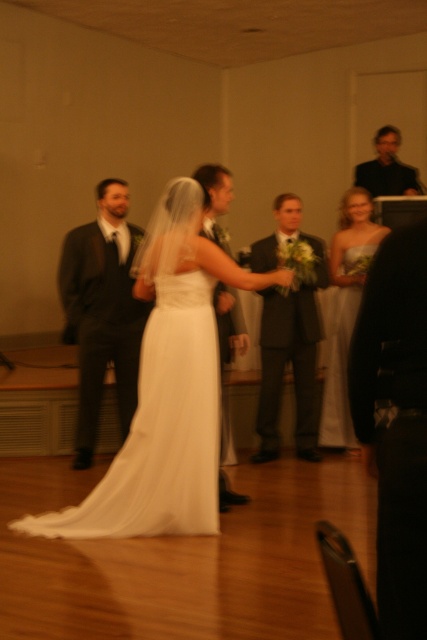
You are a photographer at a wedding reception. You need to adjust the camera focus to ensure both the silver satin dress at center and the matte black suit at center are in frame. Which one should you focus on first to account for their height difference?

The silver satin dress at center is taller than the matte black suit at center, so you should focus on the silver satin dress at center first to ensure proper framing considering its height.

In the wedding scene, there is a point marked at coordinates (287, 337). What object is located at this point?

The point at coordinates (287, 337) marks the location of the matte gray suit at center.